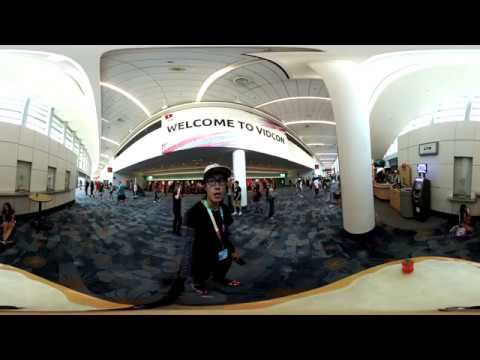
I want to click on ceiling, so click(173, 80).